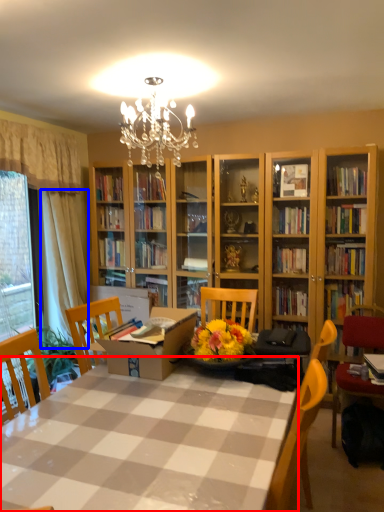
Question: Which object appears closest to the camera in this image, table (highlighted by a red box) or curtain (highlighted by a blue box)?

Choices:
 (A) table
 (B) curtain

Answer: (A)